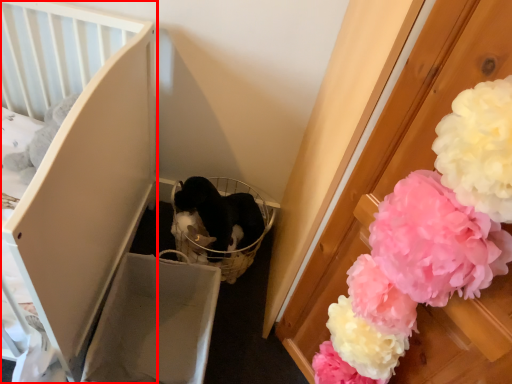
Question: From the image's perspective, what is the correct spatial relationship of furniture (annotated by the red box) in relation to flower?

Choices:
 (A) above
 (B) below

Answer: (A)